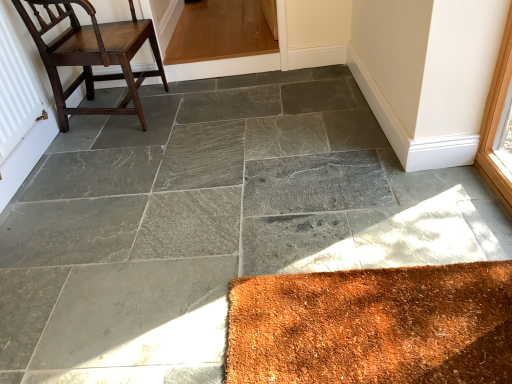
Question: Is white textured radiator at left not close to dark brown wood chair at left?

Choices:
 (A) yes
 (B) no

Answer: (B)

Question: Is white textured radiator at left closer to camera compared to dark brown wood chair at left?

Choices:
 (A) no
 (B) yes

Answer: (B)

Question: From the image's perspective, is white textured radiator at left over dark brown wood chair at left?

Choices:
 (A) no
 (B) yes

Answer: (A)

Question: Is the depth of white textured radiator at left greater than that of dark brown wood chair at left?

Choices:
 (A) yes
 (B) no

Answer: (B)

Question: Does white textured radiator at left have a larger size compared to dark brown wood chair at left?

Choices:
 (A) no
 (B) yes

Answer: (A)

Question: From a real-world perspective, is white textured radiator at left physically below dark brown wood chair at left?

Choices:
 (A) yes
 (B) no

Answer: (B)

Question: Is dark brown wood chair at left taller than white textured radiator at left?

Choices:
 (A) no
 (B) yes

Answer: (B)

Question: Is dark brown wood chair at left thinner than white textured radiator at left?

Choices:
 (A) no
 (B) yes

Answer: (A)

Question: From a real-world perspective, is dark brown wood chair at left physically above white textured radiator at left?

Choices:
 (A) no
 (B) yes

Answer: (A)

Question: Can you confirm if dark brown wood chair at left is smaller than white textured radiator at left?

Choices:
 (A) no
 (B) yes

Answer: (A)

Question: Could white textured radiator at left be considered to be inside dark brown wood chair at left?

Choices:
 (A) no
 (B) yes

Answer: (A)

Question: Is dark brown wood chair at left facing away from white textured radiator at left?

Choices:
 (A) yes
 (B) no

Answer: (B)

Question: Considering the positions of white textured radiator at left and dark brown wood chair at left in the image, is white textured radiator at left bigger or smaller than dark brown wood chair at left?

Choices:
 (A) small
 (B) big

Answer: (A)